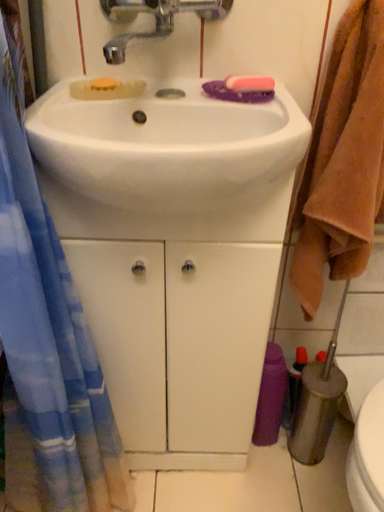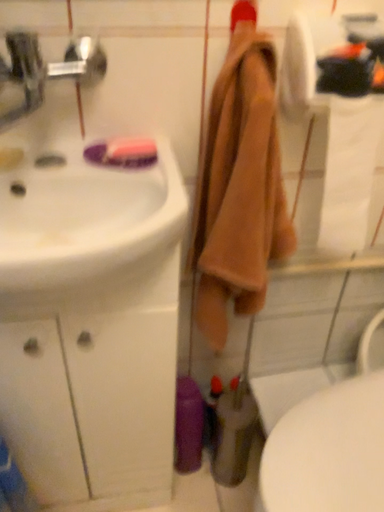
Question: Which way did the camera rotate in the video?

Choices:
 (A) rotated right
 (B) rotated left

Answer: (A)